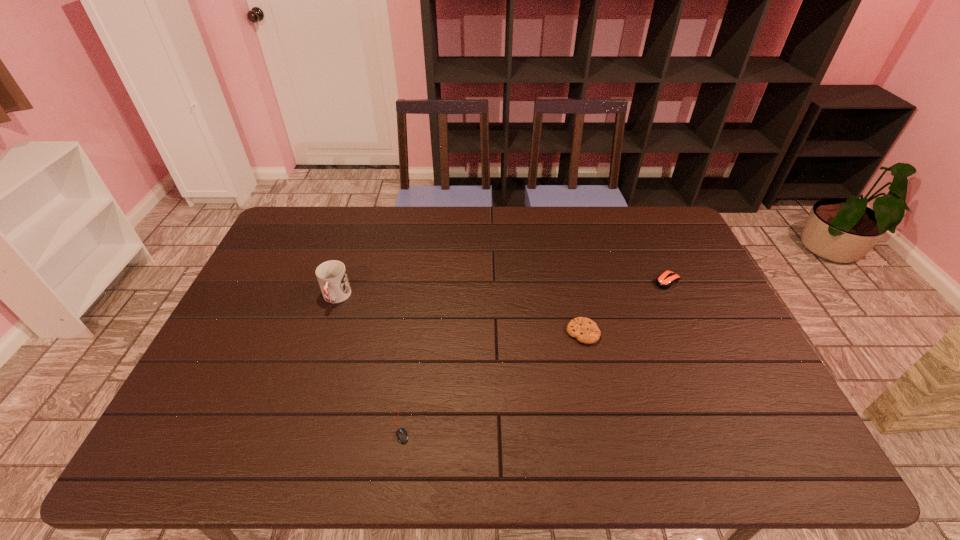
Identify the location of blank area located 0.200m on the right of the third farthest object. The height and width of the screenshot is (540, 960). (670, 333).

Identify the location of blank area located 0.390m on the left of the left mouse. The width and height of the screenshot is (960, 540). coord(228,427).

Where is `object located at the near edge`? Image resolution: width=960 pixels, height=540 pixels. object located at the near edge is located at coordinates (402, 437).

Find the location of a particular element. object that is at the right edge is located at coordinates (665, 280).

The height and width of the screenshot is (540, 960). In the image, there is a desktop. What are the coordinates of `blank space at the far edge` in the screenshot? It's located at (581, 239).

In the image, there is a desktop. What are the coordinates of `vacant space at the near edge` in the screenshot? It's located at (348, 443).

You are a GUI agent. You are given a task and a screenshot of the screen. Output one action in this format:
    pyautogui.click(x=<x>, y=<y>)
    Task: Click on the free space at the left edge of the desktop
    The image size is (960, 540).
    Given the screenshot: What is the action you would take?
    pyautogui.click(x=300, y=273)

Locate an element on the screen. The image size is (960, 540). vacant space at the right edge is located at coordinates (661, 249).

This screenshot has height=540, width=960. Find the location of `vacant space at the far left corner of the desktop`. vacant space at the far left corner of the desktop is located at coordinates point(276,246).

I want to click on vacant space at the near left corner, so [x=182, y=463].